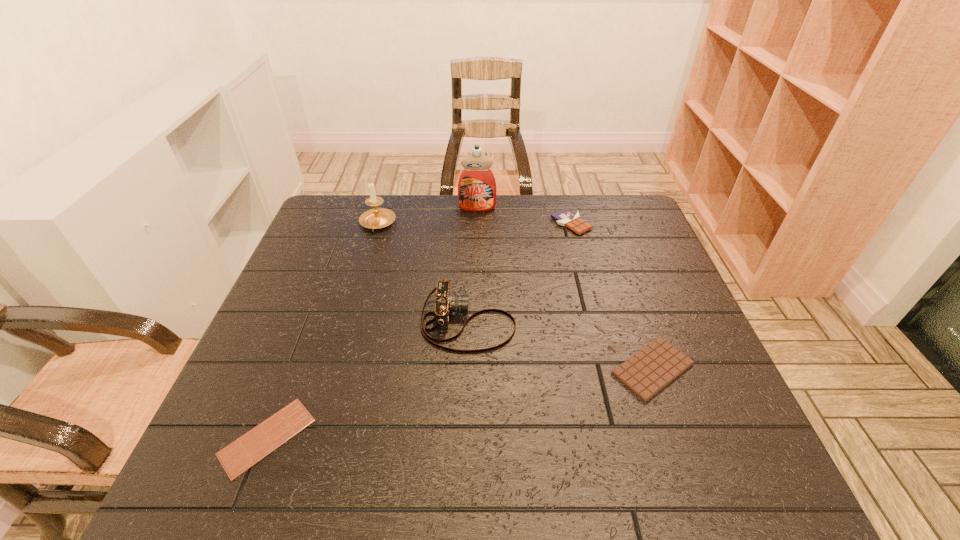
Where is `detergent`? The image size is (960, 540). detergent is located at coordinates (477, 191).

Where is `the fifth shortest object`? The width and height of the screenshot is (960, 540). the fifth shortest object is located at coordinates (376, 218).

Locate an element on the screen. the fourth shortest object is located at coordinates (445, 303).

Where is `the fourth tallest object`? the fourth tallest object is located at coordinates (564, 217).

Find the location of `the farthest chocolate bar`. the farthest chocolate bar is located at coordinates (564, 217).

This screenshot has height=540, width=960. What are the coordinates of `the second shortest object` in the screenshot? It's located at (647, 372).

At what (x,y) coordinates should I click in order to perform the action: click on the shortest object. Please return your answer as a coordinate pair (x, y). The width and height of the screenshot is (960, 540). Looking at the image, I should click on (243, 453).

Identify the location of the leftmost chocolate bar. The height and width of the screenshot is (540, 960). (243, 453).

Identify the location of free location located on the front surface of the detergent. This screenshot has width=960, height=540. (476, 284).

This screenshot has height=540, width=960. Find the location of `vacant space located 0.390m with a handle on the side of the second tallest object`. vacant space located 0.390m with a handle on the side of the second tallest object is located at coordinates (344, 336).